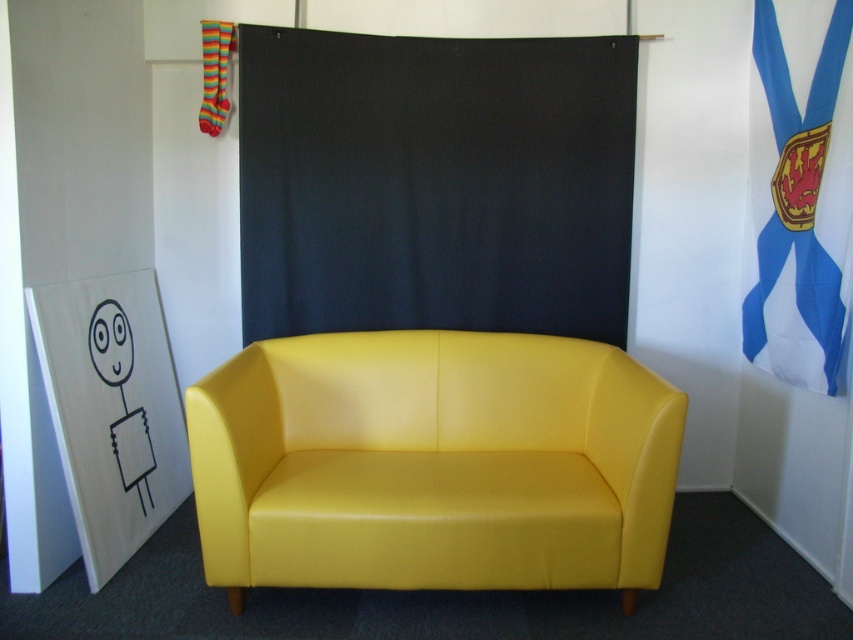
You are a visitor standing in front of the yellow leather armchair at center and the blue fabric flag at upper right. Which object is taller?

The blue fabric flag at upper right is taller than the yellow leather armchair at center.

You are standing in the room and want to know which object is taller between the black fabric curtain at center and the blue fabric flag at upper right. Based on the scene description, can you determine which one is taller?

The blue fabric flag at upper right is taller than the black fabric curtain at center.

What are the coordinates of the yellow leather armchair at center?

The yellow leather armchair at center is located at coordinates point (x=433, y=464).